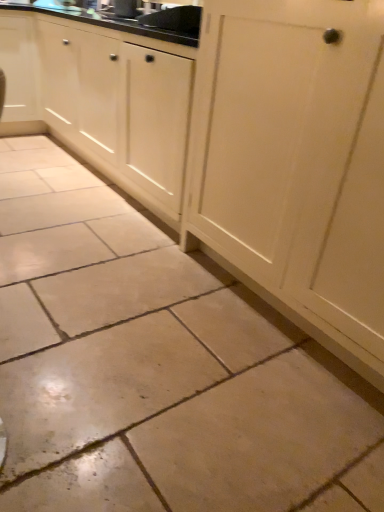
Question: Considering the relative positions of matte white cabinet at upper left, arranged as the 2th cabinetry when viewed from the right, and matte black sink at upper center in the image provided, is matte white cabinet at upper left, arranged as the 2th cabinetry when viewed from the right, in front of matte black sink at upper center?

Choices:
 (A) yes
 (B) no

Answer: (B)

Question: From a real-world perspective, does matte white cabinet at upper left, arranged as the 2th cabinetry when viewed from the right, sit lower than matte black sink at upper center?

Choices:
 (A) no
 (B) yes

Answer: (B)

Question: From the image's perspective, does matte white cabinet at upper left, arranged as the first cabinetry when viewed from the left, appear lower than matte black sink at upper center?

Choices:
 (A) yes
 (B) no

Answer: (A)

Question: Is matte white cabinet at upper left, arranged as the 2th cabinetry when viewed from the right, positioned beyond the bounds of matte black sink at upper center?

Choices:
 (A) no
 (B) yes

Answer: (B)

Question: From a real-world perspective, is matte white cabinet at upper left, arranged as the 2th cabinetry when viewed from the right, on matte black sink at upper center?

Choices:
 (A) no
 (B) yes

Answer: (A)

Question: Is point (29, 112) closer or farther from the camera than point (107, 111)?

Choices:
 (A) farther
 (B) closer

Answer: (A)

Question: In the image, is white wood cabinet at center, which is the first cabinetry in right-to-left order, positioned in front of or behind matte white cabinet at upper left, arranged as the first cabinetry when viewed from the left?

Choices:
 (A) front
 (B) behind

Answer: (A)

Question: In terms of height, does white wood cabinet at center, which is the first cabinetry in right-to-left order, look taller or shorter compared to matte white cabinet at upper left, arranged as the 2th cabinetry when viewed from the right?

Choices:
 (A) short
 (B) tall

Answer: (B)

Question: From the image's perspective, is white wood cabinet at center, the second cabinetry when ordered from left to right, located above or below matte white cabinet at upper left, arranged as the first cabinetry when viewed from the left?

Choices:
 (A) below
 (B) above

Answer: (A)

Question: Considering the positions of white wood cabinet at center, which is the first cabinetry in right-to-left order, and matte black sink at upper center in the image, is white wood cabinet at center, which is the first cabinetry in right-to-left order, taller or shorter than matte black sink at upper center?

Choices:
 (A) tall
 (B) short

Answer: (A)

Question: Do you think white wood cabinet at center, which is the first cabinetry in right-to-left order, is within matte black sink at upper center, or outside of it?

Choices:
 (A) outside
 (B) inside

Answer: (A)

Question: Considering the positions of point (21, 69) and point (125, 16), is point (21, 69) closer or farther from the camera than point (125, 16)?

Choices:
 (A) closer
 (B) farther

Answer: (B)

Question: Considering the positions of white wood cabinet at center, which is the first cabinetry in right-to-left order, and matte black sink at upper center in the image, is white wood cabinet at center, which is the first cabinetry in right-to-left order, wider or thinner than matte black sink at upper center?

Choices:
 (A) thin
 (B) wide

Answer: (B)

Question: Considering the positions of matte white cabinet at upper left, arranged as the first cabinetry when viewed from the left, and matte black sink at upper center in the image, is matte white cabinet at upper left, arranged as the first cabinetry when viewed from the left, taller or shorter than matte black sink at upper center?

Choices:
 (A) tall
 (B) short

Answer: (A)

Question: In the image, is matte white cabinet at upper left, arranged as the 2th cabinetry when viewed from the right, positioned in front of or behind matte black sink at upper center?

Choices:
 (A) behind
 (B) front

Answer: (A)